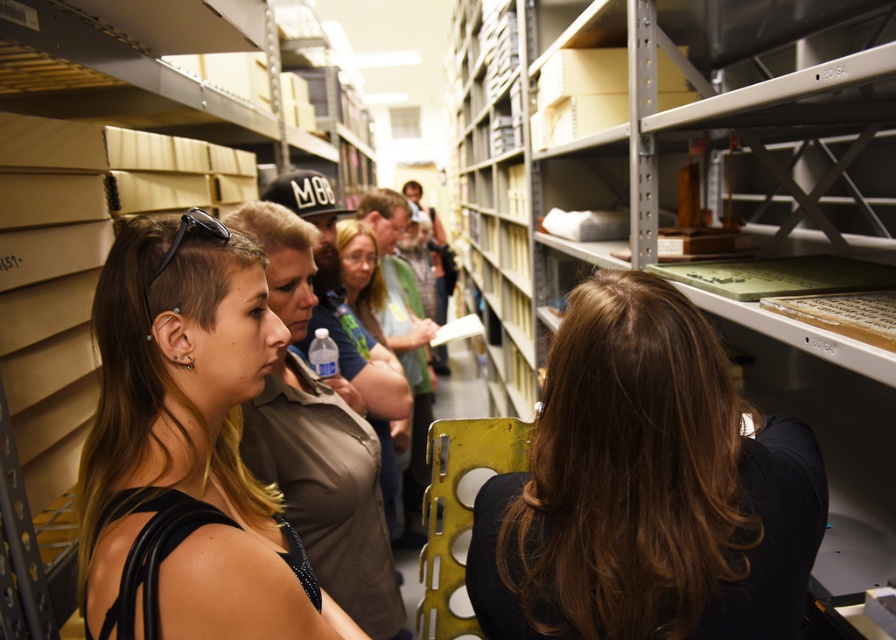
Which is in front, point (474, 100) or point (264, 312)?

Point (264, 312)

Measure the distance between metallic gray bookshelf at upper right and camera.

metallic gray bookshelf at upper right and camera are 27.12 inches apart from each other.

Locate an element on the screen. This screenshot has height=640, width=896. metallic gray bookshelf at upper right is located at coordinates (660, 141).

Is metallic gray bookshelf at upper right positioned before matte blue shirt at center?

Yes, it is.

Consider the image. Can you confirm if metallic gray bookshelf at upper right is thinner than matte blue shirt at center?

In fact, metallic gray bookshelf at upper right might be wider than matte blue shirt at center.

Is point (530, 304) closer to camera compared to point (355, 300)?

That is False.

At what (x,y) coordinates should I click in order to perform the action: click on metallic gray bookshelf at upper right. Please return your answer as a coordinate pair (x, y). The height and width of the screenshot is (640, 896). Looking at the image, I should click on (660, 141).

Can you confirm if metallic gray bookshelf at upper right is positioned to the left of brown hair at center?

In fact, metallic gray bookshelf at upper right is to the right of brown hair at center.

In order to click on metallic gray bookshelf at upper right in this screenshot , I will do `click(660, 141)`.